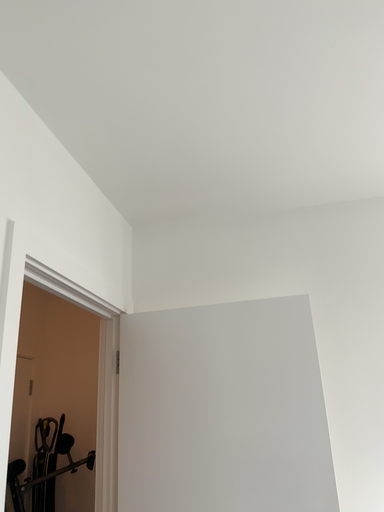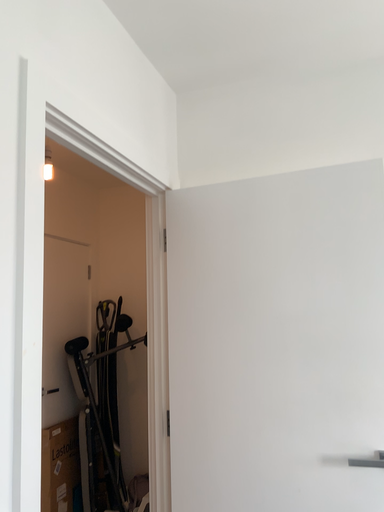
Question: Which way did the camera rotate in the video?

Choices:
 (A) rotated right
 (B) rotated left

Answer: (B)